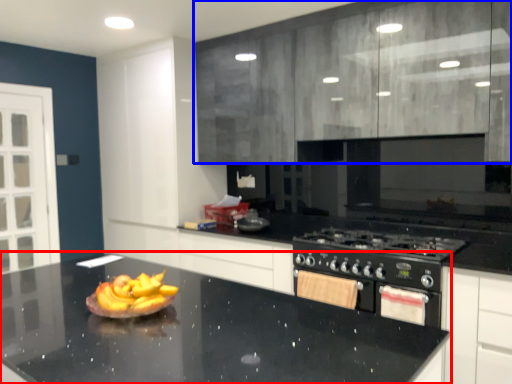
Question: Which of the following is the farthest to the observer, countertop (highlighted by a red box) or cabinetry (highlighted by a blue box)?

Choices:
 (A) countertop
 (B) cabinetry

Answer: (B)